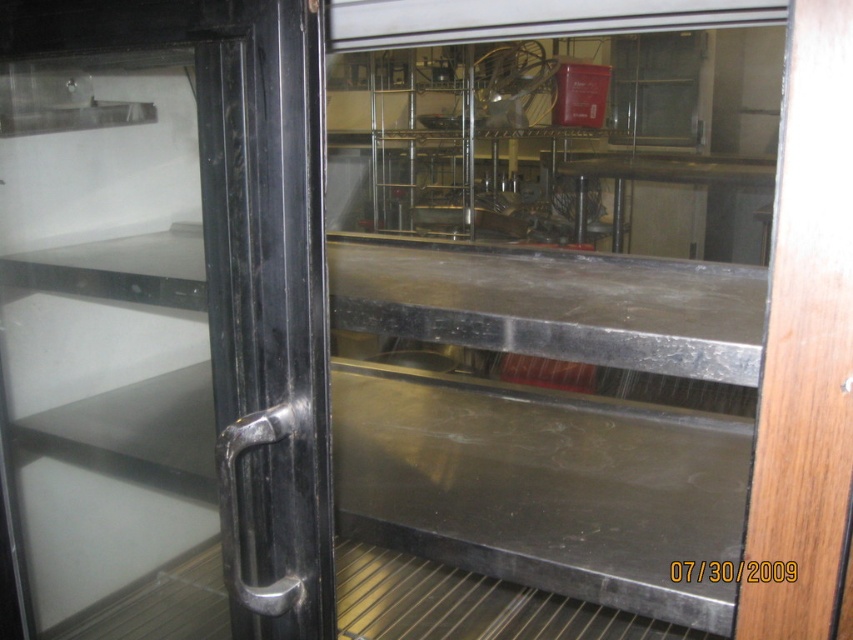
Does transparent glass door at center have a lesser height compared to black metallic handle at left?

Correct, transparent glass door at center is not as tall as black metallic handle at left.

Measure the distance between point [415,188] and camera.

Point [415,188] and camera are 15.78 feet apart from each other.

This screenshot has height=640, width=853. Identify the location of transparent glass door at center. (546, 316).